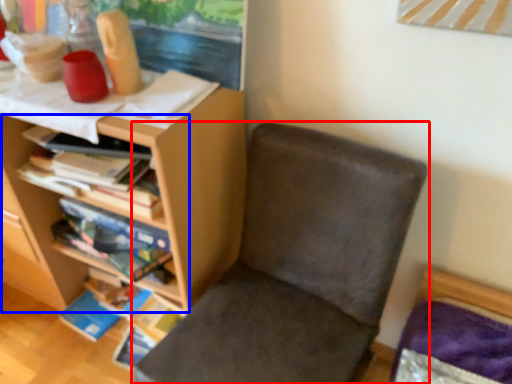
Question: Which of the following is the closest to the observer, chair (highlighted by a red box) or shelf (highlighted by a blue box)?

Choices:
 (A) chair
 (B) shelf

Answer: (A)